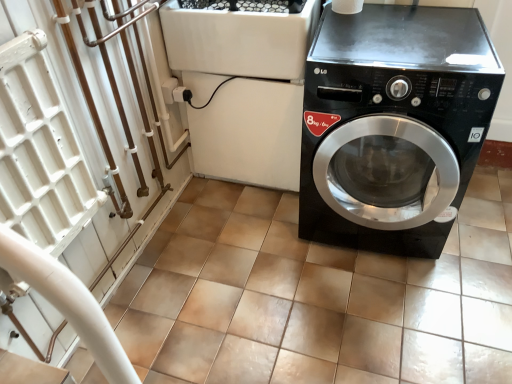
Question: From the image's perspective, is black plastic washing machine at center above or below black glossy washing machine at right?

Choices:
 (A) above
 (B) below

Answer: (A)

Question: Based on their positions, is black plastic washing machine at center located to the left or right of black glossy washing machine at right?

Choices:
 (A) left
 (B) right

Answer: (A)

Question: Which object is positioned closest to the black glossy washing machine at right?

Choices:
 (A) brown tile at center
 (B) black plastic washing machine at center

Answer: (B)

Question: Considering the real-world distances, which object is closest to the black plastic washing machine at center?

Choices:
 (A) brown tile at center
 (B) black glossy washing machine at right

Answer: (B)